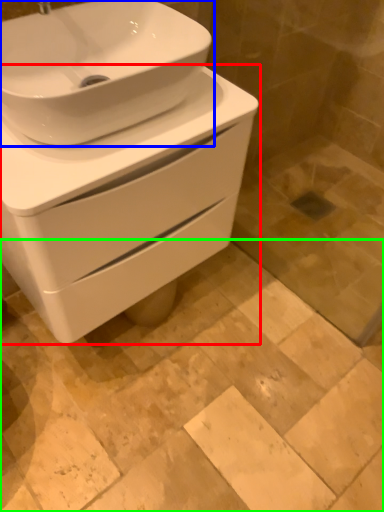
Question: Based on their relative distances, which object is farther from toilet (highlighted by a red box)? Choose from sink (highlighted by a blue box) and ceramic tile (highlighted by a green box).

Choices:
 (A) sink
 (B) ceramic tile

Answer: (B)